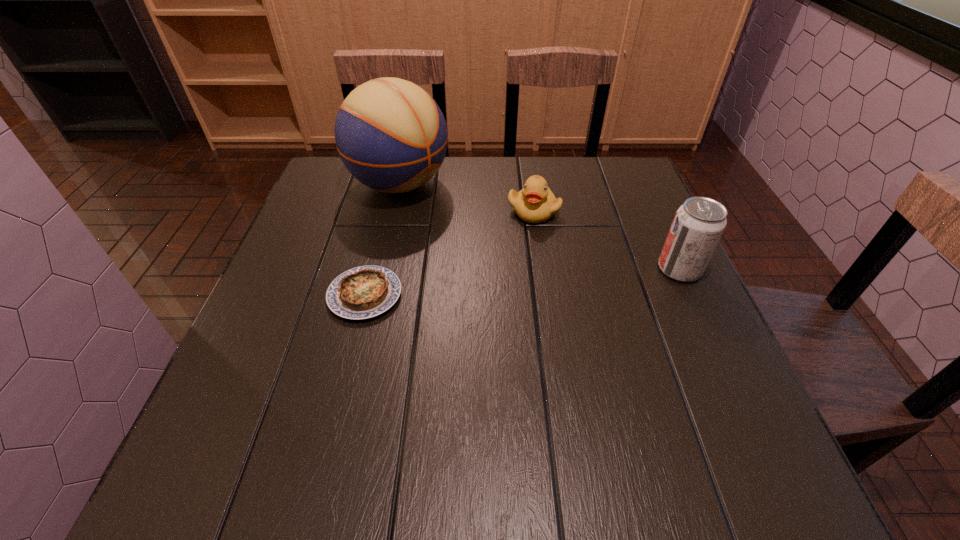
At what (x,y) coordinates should I click in order to perform the action: click on the shortest object. Please return your answer as a coordinate pair (x, y). The height and width of the screenshot is (540, 960). Looking at the image, I should click on (363, 292).

At what (x,y) coordinates should I click in order to perform the action: click on the rightmost object. Please return your answer as a coordinate pair (x, y). This screenshot has height=540, width=960. Looking at the image, I should click on (699, 223).

Locate an element on the screen. The height and width of the screenshot is (540, 960). soda can is located at coordinates [699, 223].

Image resolution: width=960 pixels, height=540 pixels. In order to click on basketball in this screenshot , I will do `click(391, 135)`.

This screenshot has height=540, width=960. Find the location of `the second shortest object`. the second shortest object is located at coordinates (535, 203).

The height and width of the screenshot is (540, 960). In order to click on the third object from left to right in this screenshot , I will do `click(535, 203)`.

Identify the location of vacant space situated 0.280m on the back of the quiche. (390, 197).

Locate an element on the screen. The width and height of the screenshot is (960, 540). free space located on the left of the third shortest object is located at coordinates (572, 269).

The width and height of the screenshot is (960, 540). Find the location of `vacant region located 0.180m on the patterned surface of the basketball`. vacant region located 0.180m on the patterned surface of the basketball is located at coordinates (484, 236).

Identify the location of free space located on the patterned surface of the basketball. (513, 253).